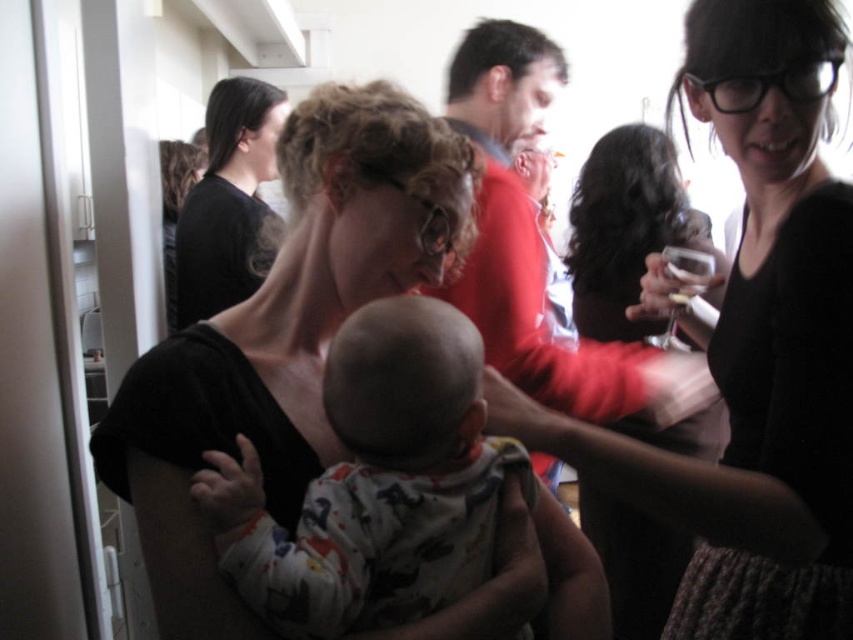
Question: Which point appears farthest from the camera in this image?

Choices:
 (A) (410, 480)
 (B) (621, 529)

Answer: (B)

Question: Can you confirm if black textured dress at upper right is positioned below matte black dress at upper right?

Choices:
 (A) no
 (B) yes

Answer: (A)

Question: Is black textured dress at upper right below white cotton onesie at center?

Choices:
 (A) yes
 (B) no

Answer: (B)

Question: Is black textured dress at upper right smaller than matte black dress at upper right?

Choices:
 (A) yes
 (B) no

Answer: (A)

Question: Which object is farther from the camera taking this photo?

Choices:
 (A) black plastic glasses at upper right
 (B) white cotton onesie at center
 (C) black matte shirt at center
 (D) matte black dress at upper right

Answer: (D)

Question: Which object is positioned farthest from the black matte shirt at upper left?

Choices:
 (A) white cotton onesie at center
 (B) black matte shirt at center
 (C) black textured dress at upper right
 (D) clear glass wine glass at upper right

Answer: (D)